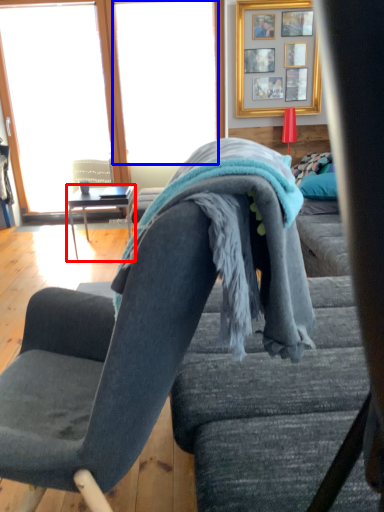
Question: Among these objects, which one is farthest to the camera, table (highlighted by a red box) or window screen (highlighted by a blue box)?

Choices:
 (A) table
 (B) window screen

Answer: (B)